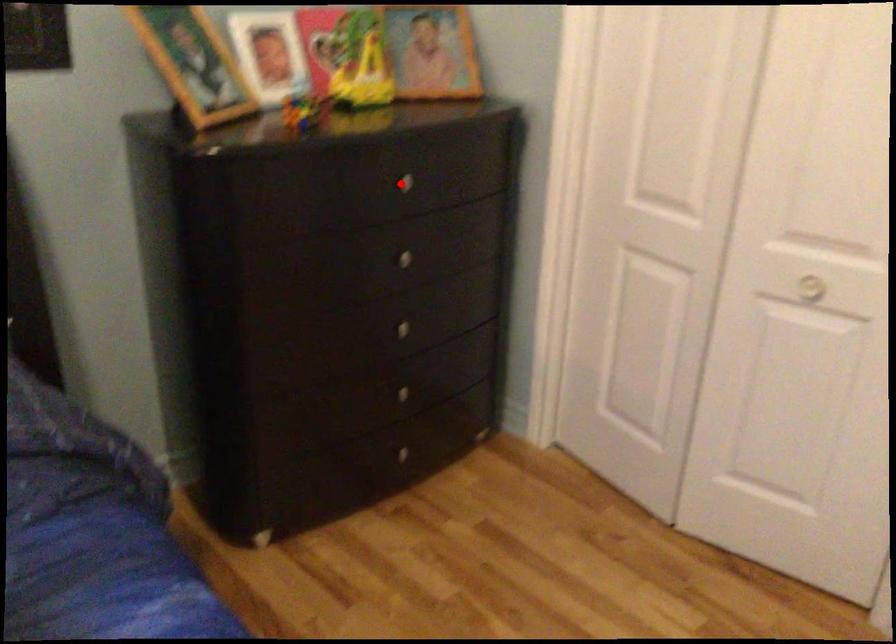
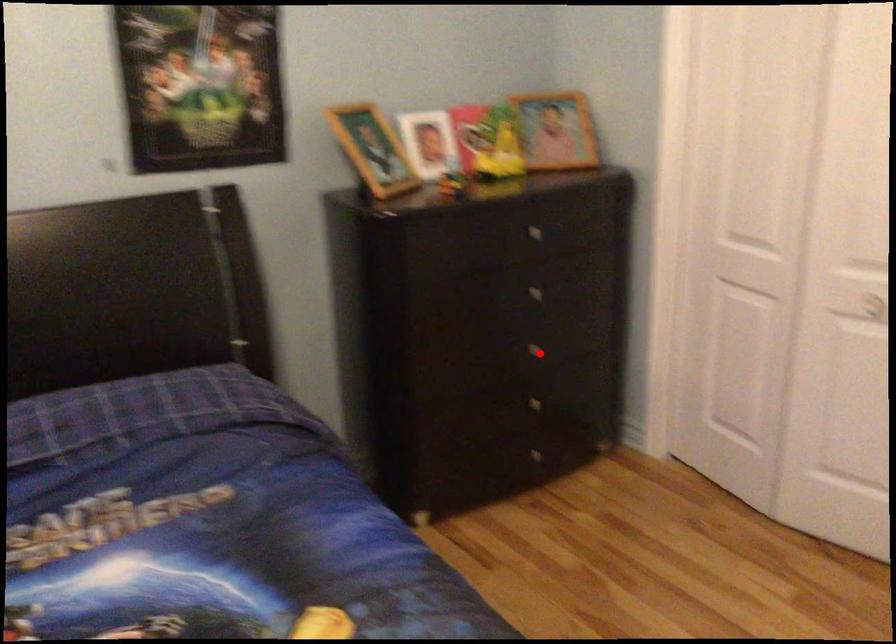
I am providing you with two images of the same scene from different viewpoints. A red point is marked on the first image and another point is marked on the second image. Do the highlighted points in image1 and image2 indicate the same real-world spot?

No